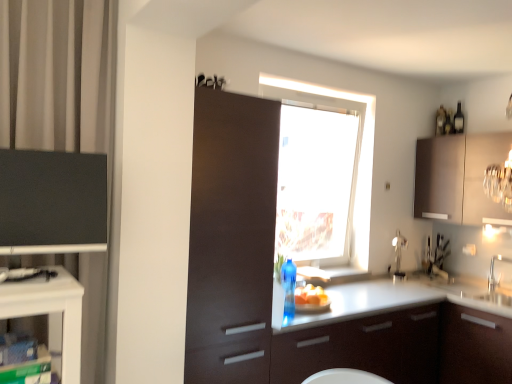
Question: Is transparent glass window at center thinner than satin brown cabinet at upper right, the first cabinetry in the right-to-left sequence?

Choices:
 (A) yes
 (B) no

Answer: (A)

Question: From a real-world perspective, is transparent glass window at center positioned under satin brown cabinet at upper right, the third cabinetry in the left-to-right sequence, based on gravity?

Choices:
 (A) yes
 (B) no

Answer: (A)

Question: Is transparent glass window at center at the right side of satin brown cabinet at upper right, the 1th cabinetry positioned from the back?

Choices:
 (A) no
 (B) yes

Answer: (A)

Question: Considering the relative positions of transparent glass window at center and satin brown cabinet at upper right, acting as the third cabinetry starting from the front, in the image provided, is transparent glass window at center in front of satin brown cabinet at upper right, acting as the third cabinetry starting from the front,?

Choices:
 (A) yes
 (B) no

Answer: (A)

Question: Does transparent glass window at center contain satin brown cabinet at upper right, the third cabinetry in the left-to-right sequence?

Choices:
 (A) yes
 (B) no

Answer: (B)

Question: From a real-world perspective, is white glossy countertop at center physically located above or below black glass bottle at upper right?

Choices:
 (A) above
 (B) below

Answer: (B)

Question: In terms of size, does white glossy countertop at center appear bigger or smaller than black glass bottle at upper right?

Choices:
 (A) big
 (B) small

Answer: (A)

Question: From the image's perspective, is white glossy countertop at center above or below black glass bottle at upper right?

Choices:
 (A) above
 (B) below

Answer: (B)

Question: Visually, is white glossy countertop at center positioned to the left or to the right of black glass bottle at upper right?

Choices:
 (A) right
 (B) left

Answer: (B)

Question: Would you say matte brown cabinet at center, the second cabinetry in the left-to-right sequence, is to the left or to the right of yellow matte bread at lower center in the picture?

Choices:
 (A) left
 (B) right

Answer: (A)

Question: From a real-world perspective, relative to yellow matte bread at lower center, is matte brown cabinet at center, the second cabinetry in the left-to-right sequence, vertically above or below?

Choices:
 (A) above
 (B) below

Answer: (A)

Question: Which is correct: matte brown cabinet at center, which appears as the 2th cabinetry when viewed from the front, is inside yellow matte bread at lower center, or outside of it?

Choices:
 (A) outside
 (B) inside

Answer: (A)

Question: Is matte brown cabinet at center, the 2th cabinetry from the back, in front of or behind yellow matte bread at lower center in the image?

Choices:
 (A) behind
 (B) front

Answer: (B)

Question: From a real-world perspective, is white glossy countertop at center positioned above or below transparent glass window at center?

Choices:
 (A) above
 (B) below

Answer: (B)

Question: Looking at their shapes, would you say white glossy countertop at center is wider or thinner than transparent glass window at center?

Choices:
 (A) wide
 (B) thin

Answer: (A)